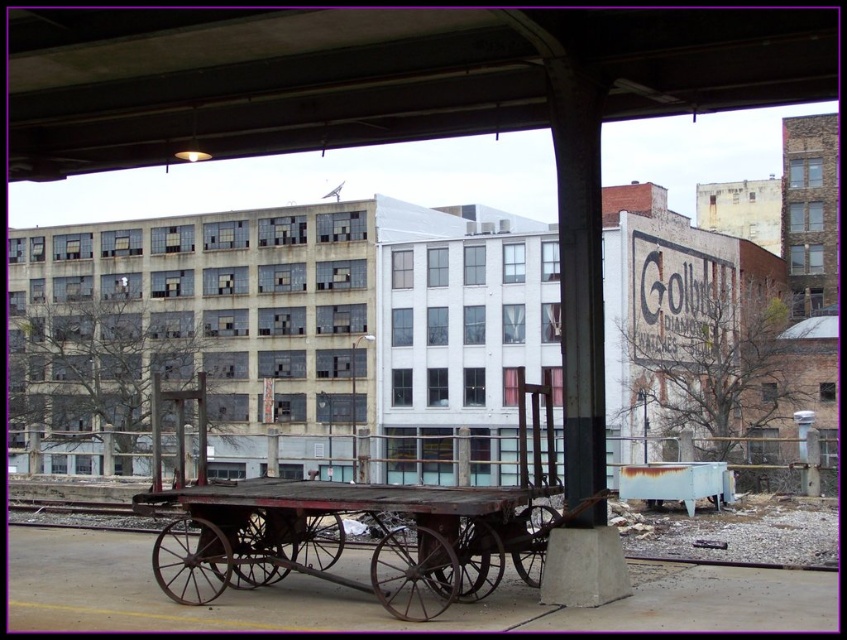
Question: Can you confirm if concrete ceiling at upper center is positioned below rusty metal train track at lower center?

Choices:
 (A) yes
 (B) no

Answer: (B)

Question: Among these points, which one is farthest from the camera?

Choices:
 (A) (602, 68)
 (B) (115, 529)

Answer: (B)

Question: Is concrete ceiling at upper center to the left of rusty metal train track at lower center from the viewer's perspective?

Choices:
 (A) yes
 (B) no

Answer: (B)

Question: Is concrete ceiling at upper center wider than rusty metal train track at lower center?

Choices:
 (A) yes
 (B) no

Answer: (B)

Question: Which point is farther to the camera?

Choices:
 (A) concrete ceiling at upper center
 (B) rusty metal train track at lower center

Answer: (A)